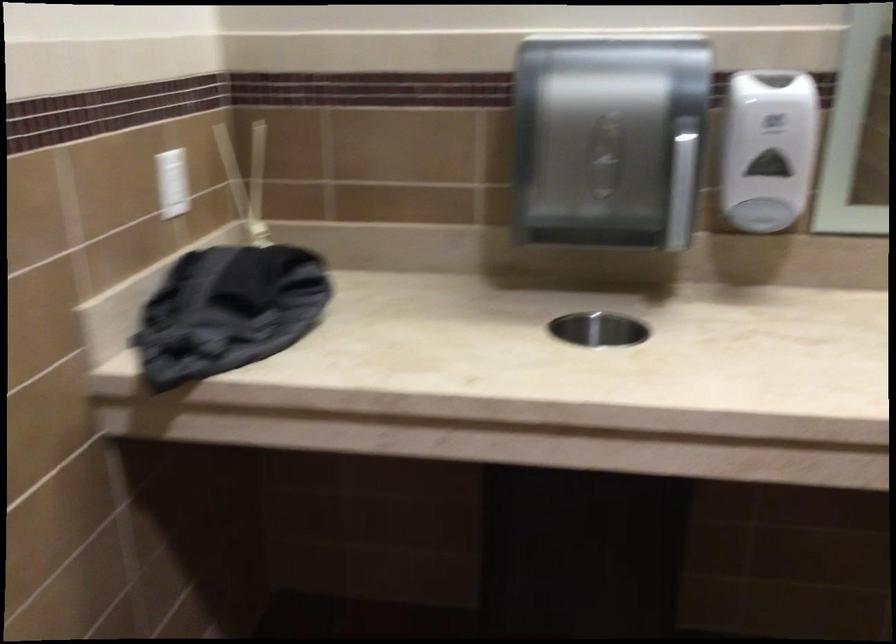
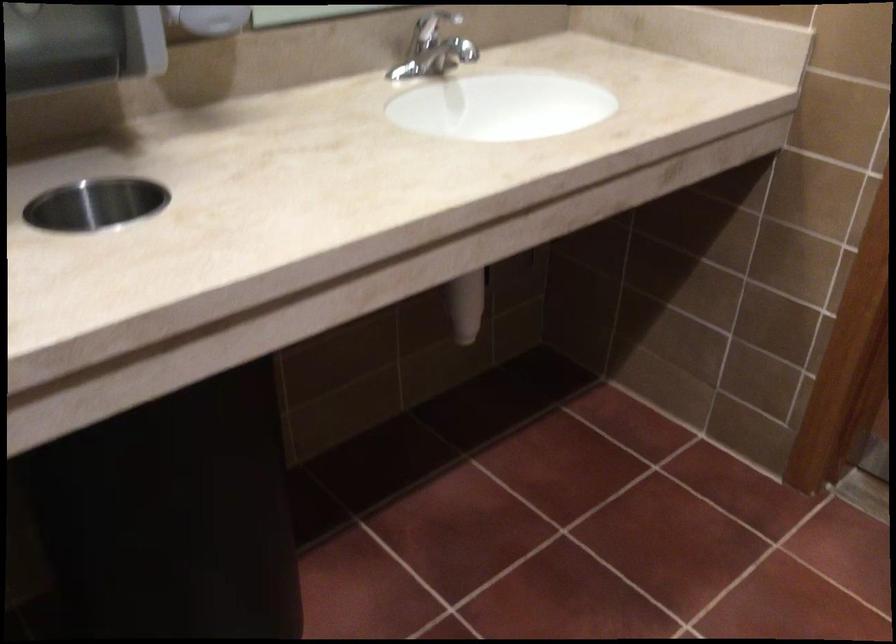
First-person continuous shooting, in which direction is the camera rotating?

The camera rotated toward right-down.